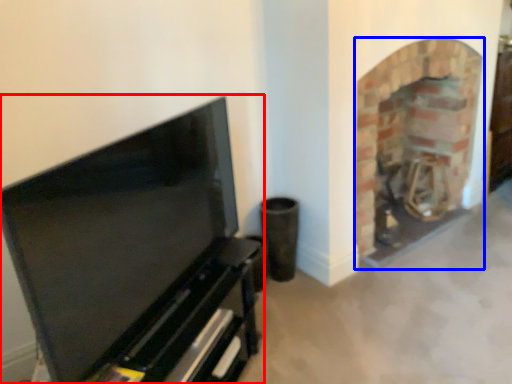
Question: Which point is closer to the camera, entertainment center (highlighted by a red box) or fireplace (highlighted by a blue box)?

Choices:
 (A) entertainment center
 (B) fireplace

Answer: (A)